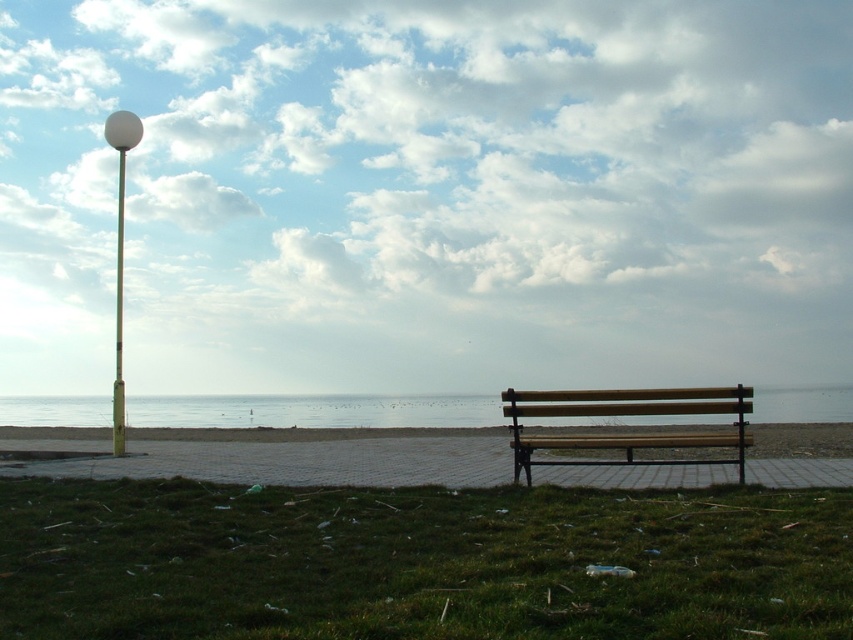
You are a photographer trying to capture the white glossy lamp post at upper left and the blue water at center in the same frame. Based on their sizes in the image, which one will appear larger?

The white glossy lamp post at upper left appears larger than the blue water at center in the image because the blue water at center has a smaller size compared to the white glossy lamp post at upper left.

You are a park ranger checking the coastal area. You need to place a new sign near the wooden bench at center so it stays dry during rain. Since the area around the bench is often wet, where should you place the sign relative to the metallic pole at left to ensure it stays dry?

The wooden bench at center is positioned under the metallic pole at left, so placing the sign under the metallic pole at left would provide shelter from the rain, keeping it dry.

You are a tourist standing at the start of the walkway and want to reach the wooden bench at center. Which direction should you walk to get there without crossing the blue water at center?

The blue water at center is in front of the wooden bench at center, so you should walk towards the wooden bench at center by going around the blue water at center either to the left or right side to avoid crossing it.